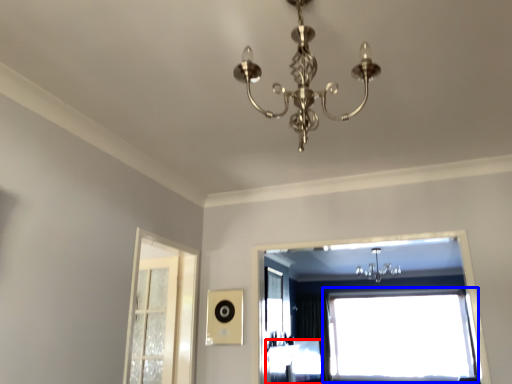
Question: Among these objects, which one is farthest to the camera, furniture (highlighted by a red box) or window (highlighted by a blue box)?

Choices:
 (A) furniture
 (B) window

Answer: (B)